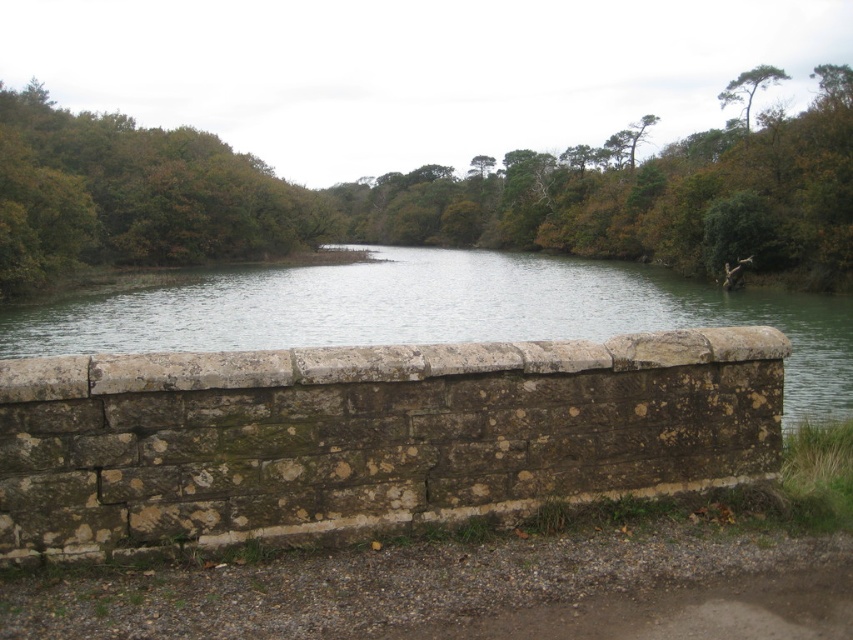
Is point (795, 132) less distant than point (750, 74)?

Yes, it is.

Based on the photo, can you confirm if green leafy tree at center is positioned to the right of green textured tree at upper right?

In fact, green leafy tree at center is to the left of green textured tree at upper right.

Between point (593, 160) and point (759, 80), which one is positioned behind?

The point (593, 160) is behind.

I want to click on green leafy tree at center, so click(427, 196).

Is green leafy tree at center above greenish stone river at center?

Correct, green leafy tree at center is located above greenish stone river at center.

Which is behind, point (6, 193) or point (76, 301)?

Positioned behind is point (6, 193).

Find the location of `green leafy tree at center`. green leafy tree at center is located at coordinates (427, 196).

Who is more forward, (x=242, y=292) or (x=757, y=80)?

Point (x=242, y=292)

How far apart are greenish stone river at center and green textured tree at upper right?

greenish stone river at center and green textured tree at upper right are 52.94 meters apart from each other.

In order to click on greenish stone river at center in this screenshot , I will do `click(442, 312)`.

At what (x,y) coordinates should I click in order to perform the action: click on greenish stone river at center. Please return your answer as a coordinate pair (x, y). The height and width of the screenshot is (640, 853). Looking at the image, I should click on (442, 312).